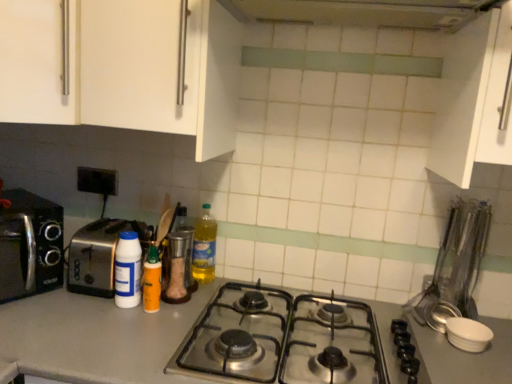
Image resolution: width=512 pixels, height=384 pixels. What are the coordinates of `vacant area that is in front of orange matte squeeze bottle at center, the second bottle viewed from the left` in the screenshot? It's located at (124, 334).